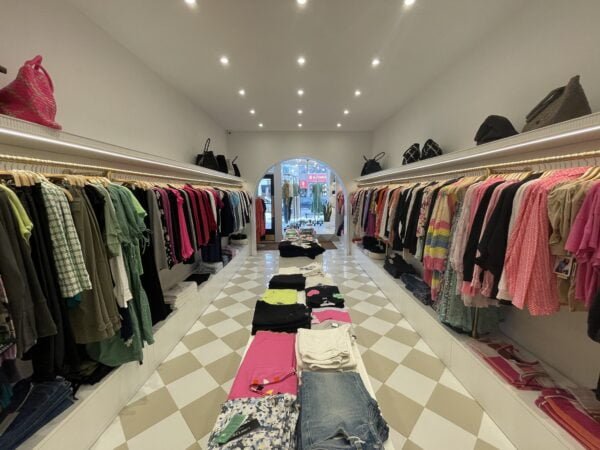
The width and height of the screenshot is (600, 450). Identify the location of door. (263, 191).